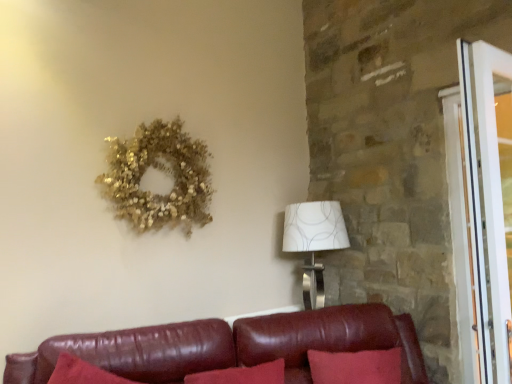
Measure the distance between point (x=502, y=275) and camera.

The depth of point (x=502, y=275) is 1.40 meters.

Measure the distance between leather couch at lower center and camera.

leather couch at lower center and camera are 1.79 meters apart from each other.

The height and width of the screenshot is (384, 512). I want to click on white textured lampshade at right, so click(314, 241).

From the image's perspective, is white textured lampshade at right positioned above or below white glossy screen door at right?

From the image's perspective, white textured lampshade at right appears below white glossy screen door at right.

Does white textured lampshade at right contain white glossy screen door at right?

Definitely not — white glossy screen door at right is not inside white textured lampshade at right.

Considering the positions of objects white textured lampshade at right and white glossy screen door at right in the image provided, who is more to the left, white textured lampshade at right or white glossy screen door at right?

white textured lampshade at right is more to the left.

Considering the sizes of objects white textured lampshade at right and white glossy screen door at right in the image provided, who is shorter, white textured lampshade at right or white glossy screen door at right?

With less height is white textured lampshade at right.

Does white textured lampshade at right turn towards leather couch at lower center?

No, white textured lampshade at right is not aimed at leather couch at lower center.

From the image's perspective, who appears lower, white textured lampshade at right or leather couch at lower center?

leather couch at lower center appears lower in the image.

In the scene shown: Is white textured lampshade at right located outside leather couch at lower center?

Yes, white textured lampshade at right is located beyond the bounds of leather couch at lower center.

Between white textured lampshade at right and leather couch at lower center, which one is positioned in front?

Positioned in front is leather couch at lower center.

Which object is further away from the camera taking this photo, white glossy screen door at right or gold glittery wreath at upper left?

gold glittery wreath at upper left is more distant.

Looking at the image, does white glossy screen door at right seem bigger or smaller compared to gold glittery wreath at upper left?

white glossy screen door at right is smaller than gold glittery wreath at upper left.

Does white glossy screen door at right appear on the left side of gold glittery wreath at upper left?

Incorrect, white glossy screen door at right is not on the left side of gold glittery wreath at upper left.

Is point (482, 155) less distant than point (139, 189)?

Yes, point (482, 155) is in front of point (139, 189).

Locate an element on the screen. table lamp directly beneath the gold glittery wreath at upper left (from a real-world perspective) is located at coordinates (314, 241).

Is white textured lampshade at right behind gold glittery wreath at upper left?

Yes, it is behind gold glittery wreath at upper left.

Can you confirm if white textured lampshade at right is positioned to the left of gold glittery wreath at upper left?

In fact, white textured lampshade at right is to the right of gold glittery wreath at upper left.

Is white textured lampshade at right wider than gold glittery wreath at upper left?

Indeed, white textured lampshade at right has a greater width compared to gold glittery wreath at upper left.

Does point (370, 335) come farther from viewer compared to point (162, 204)?

No.

Is leather couch at lower center taller or shorter than gold glittery wreath at upper left?

Considering their sizes, leather couch at lower center has less height than gold glittery wreath at upper left.

Could you tell me if leather couch at lower center is turned towards gold glittery wreath at upper left?

No.

Based on their sizes in the image, would you say leather couch at lower center is bigger or smaller than gold glittery wreath at upper left?

Considering their sizes, leather couch at lower center takes up more space than gold glittery wreath at upper left.

From the image's perspective, is gold glittery wreath at upper left located beneath white textured lampshade at right?

No, from the image's perspective, gold glittery wreath at upper left is not beneath white textured lampshade at right.

Considering the sizes of objects gold glittery wreath at upper left and white textured lampshade at right in the image provided, who is bigger, gold glittery wreath at upper left or white textured lampshade at right?

white textured lampshade at right is bigger.

At what (x,y) coordinates should I click in order to perform the action: click on decor on the left of white textured lampshade at right. Please return your answer as a coordinate pair (x, y). This screenshot has width=512, height=384. Looking at the image, I should click on (161, 170).

From the image's perspective, which one is positioned higher, gold glittery wreath at upper left or white glossy screen door at right?

gold glittery wreath at upper left.

From the picture: Can you tell me how much gold glittery wreath at upper left and white glossy screen door at right differ in facing direction?

1.21 degrees.

Does gold glittery wreath at upper left have a greater width compared to white glossy screen door at right?

Yes.

Between gold glittery wreath at upper left and white glossy screen door at right, which one has smaller size?

white glossy screen door at right.

You are a GUI agent. You are given a task and a screenshot of the screen. Output one action in this format:
    pyautogui.click(x=<x>, y=<y>)
    Task: Click on the screen door above the white textured lampshade at right (from the image's perspective)
    The height and width of the screenshot is (384, 512).
    Given the screenshot: What is the action you would take?
    pyautogui.click(x=481, y=208)

You are a GUI agent. You are given a task and a screenshot of the screen. Output one action in this format:
    pyautogui.click(x=<x>, y=<y>)
    Task: Click on the studio couch directly beneath the white textured lampshade at right (from a real-world perspective)
    
    Given the screenshot: What is the action you would take?
    pyautogui.click(x=230, y=345)

Considering their positions, is white glossy screen door at right positioned further to leather couch at lower center than gold glittery wreath at upper left?

Based on the image, white glossy screen door at right appears to be further to leather couch at lower center.

Estimate the real-world distances between objects in this image. Which object is further from white textured lampshade at right, gold glittery wreath at upper left or leather couch at lower center?

gold glittery wreath at upper left is further to white textured lampshade at right.

Looking at the image, which one is located further to leather couch at lower center, white textured lampshade at right or gold glittery wreath at upper left?

gold glittery wreath at upper left lies further to leather couch at lower center than the other object.

Consider the image. From the image, which object appears to be nearer to white glossy screen door at right, white textured lampshade at right or gold glittery wreath at upper left?

Among the two, white textured lampshade at right is located nearer to white glossy screen door at right.

Looking at the image, which one is located further to white glossy screen door at right, leather couch at lower center or gold glittery wreath at upper left?

gold glittery wreath at upper left is further to white glossy screen door at right.

When comparing their distances from gold glittery wreath at upper left, does leather couch at lower center or white glossy screen door at right seem further?

Among the two, white glossy screen door at right is located further to gold glittery wreath at upper left.

Considering their positions, is white textured lampshade at right positioned closer to white glossy screen door at right than leather couch at lower center?

leather couch at lower center.

When comparing their distances from white textured lampshade at right, does gold glittery wreath at upper left or white glossy screen door at right seem further?

The object further to white textured lampshade at right is white glossy screen door at right.

Locate an element on the screen. Image resolution: width=512 pixels, height=384 pixels. decor between leather couch at lower center and white textured lampshade at right in the front-back direction is located at coordinates (161, 170).

Image resolution: width=512 pixels, height=384 pixels. What are the coordinates of `screen door between leather couch at lower center and white textured lampshade at right along the z-axis` in the screenshot? It's located at (481, 208).

Where is `studio couch situated between gold glittery wreath at upper left and white glossy screen door at right from left to right`? studio couch situated between gold glittery wreath at upper left and white glossy screen door at right from left to right is located at coordinates [x=230, y=345].

At what (x,y) coordinates should I click in order to perform the action: click on table lamp between gold glittery wreath at upper left and white glossy screen door at right. Please return your answer as a coordinate pair (x, y). This screenshot has height=384, width=512. Looking at the image, I should click on (314, 241).